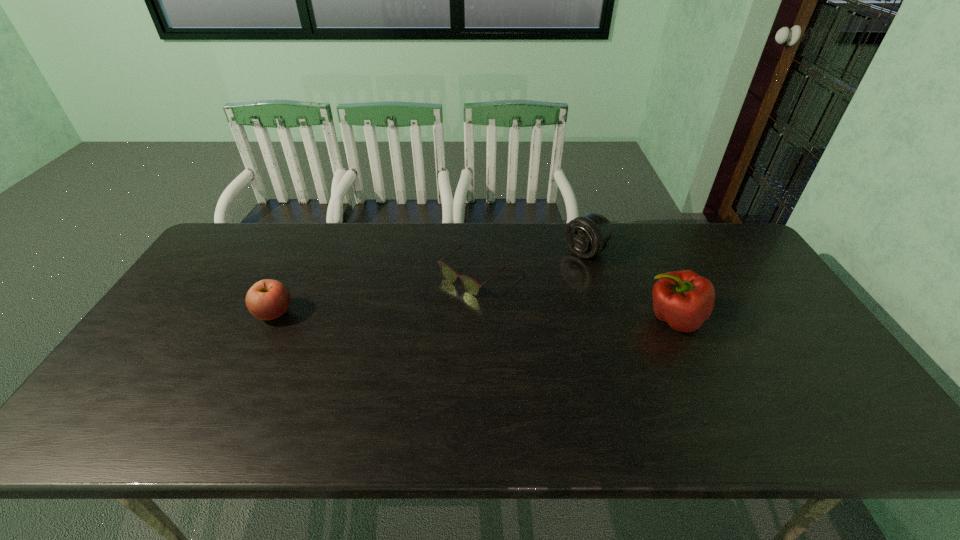
The image size is (960, 540). Find the location of `free space at the far left corner of the desktop`. free space at the far left corner of the desktop is located at coordinates (x=223, y=235).

At what (x,y) coordinates should I click in order to perform the action: click on vacant position at the near left corner of the desktop. Please return your answer as a coordinate pair (x, y). This screenshot has width=960, height=540. Looking at the image, I should click on (170, 400).

Image resolution: width=960 pixels, height=540 pixels. In the image, there is a desktop. Identify the location of vacant region at the far right corner. (728, 251).

You are a GUI agent. You are given a task and a screenshot of the screen. Output one action in this format:
    pyautogui.click(x=<x>, y=<y>)
    Task: Click on the free spot between the spectacles and the leftmost object
    Image resolution: width=960 pixels, height=540 pixels.
    Given the screenshot: What is the action you would take?
    pyautogui.click(x=374, y=294)

I want to click on vacant space that's between the rightmost object and the apple, so click(473, 316).

Where is `empty space that is in between the telephoto lens and the shortest object`? This screenshot has width=960, height=540. empty space that is in between the telephoto lens and the shortest object is located at coordinates (531, 264).

In order to click on vacant space that is in between the apple and the bell pepper in this screenshot , I will do `click(473, 316)`.

This screenshot has height=540, width=960. What are the coordinates of `vacant space that is in between the apple and the telephoto lens` in the screenshot? It's located at (430, 282).

What are the coordinates of `vacant space that is in between the leftmost object and the third object from left to right` in the screenshot? It's located at (430, 282).

Identify the location of free area in between the telephoto lens and the shortest object. pos(531,264).